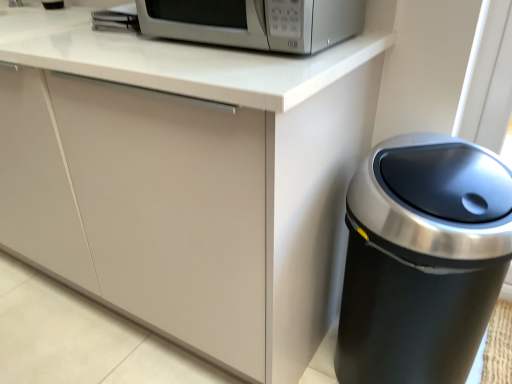
Question: From a real-world perspective, is black metallic trash can at right positioned above or below satin silver microwave at upper center?

Choices:
 (A) below
 (B) above

Answer: (A)

Question: Does point (458, 309) appear closer or farther from the camera than point (357, 18)?

Choices:
 (A) closer
 (B) farther

Answer: (A)

Question: Is black metallic trash can at right taller or shorter than satin silver microwave at upper center?

Choices:
 (A) short
 (B) tall

Answer: (B)

Question: Is satin silver microwave at upper center to the left or to the right of black metallic trash can at right in the image?

Choices:
 (A) left
 (B) right

Answer: (A)

Question: Based on their sizes in the image, would you say satin silver microwave at upper center is bigger or smaller than black metallic trash can at right?

Choices:
 (A) small
 (B) big

Answer: (A)

Question: Choose the correct answer: Is satin silver microwave at upper center inside black metallic trash can at right or outside it?

Choices:
 (A) inside
 (B) outside

Answer: (B)

Question: Considering their positions, is satin silver microwave at upper center located in front of or behind black metallic trash can at right?

Choices:
 (A) front
 (B) behind

Answer: (B)